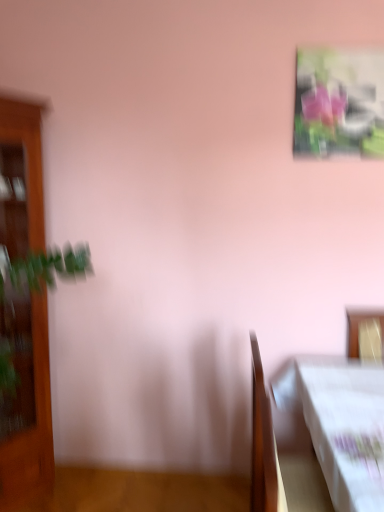
Question: Does wooden cabinet at left have a larger size compared to wooden table at lower right?

Choices:
 (A) no
 (B) yes

Answer: (B)

Question: Are wooden cabinet at left and wooden table at lower right far apart?

Choices:
 (A) no
 (B) yes

Answer: (B)

Question: Is wooden cabinet at left shorter than wooden table at lower right?

Choices:
 (A) yes
 (B) no

Answer: (B)

Question: Is wooden cabinet at left next to wooden table at lower right?

Choices:
 (A) yes
 (B) no

Answer: (B)

Question: Is wooden cabinet at left positioned in front of wooden table at lower right?

Choices:
 (A) yes
 (B) no

Answer: (B)

Question: From the image's perspective, is metallic glossy picture frame at upper right positioned above or below wooden cabinet at left?

Choices:
 (A) below
 (B) above

Answer: (B)

Question: Is metallic glossy picture frame at upper right wider or thinner than wooden cabinet at left?

Choices:
 (A) thin
 (B) wide

Answer: (A)

Question: From a real-world perspective, is metallic glossy picture frame at upper right physically located above or below wooden cabinet at left?

Choices:
 (A) below
 (B) above

Answer: (B)

Question: Does point (359, 151) appear closer or farther from the camera than point (34, 129)?

Choices:
 (A) farther
 (B) closer

Answer: (A)

Question: Considering their positions, is wooden table at lower right located in front of or behind metallic glossy picture frame at upper right?

Choices:
 (A) front
 (B) behind

Answer: (A)

Question: Is point (370, 476) closer or farther from the camera than point (326, 53)?

Choices:
 (A) farther
 (B) closer

Answer: (B)

Question: Based on their positions, is wooden table at lower right located to the left or right of metallic glossy picture frame at upper right?

Choices:
 (A) left
 (B) right

Answer: (A)

Question: In terms of size, does wooden table at lower right appear bigger or smaller than metallic glossy picture frame at upper right?

Choices:
 (A) big
 (B) small

Answer: (A)

Question: Is wooden table at lower right wider or thinner than wooden cabinet at left?

Choices:
 (A) thin
 (B) wide

Answer: (A)

Question: Do you think wooden table at lower right is within wooden cabinet at left, or outside of it?

Choices:
 (A) outside
 (B) inside

Answer: (A)